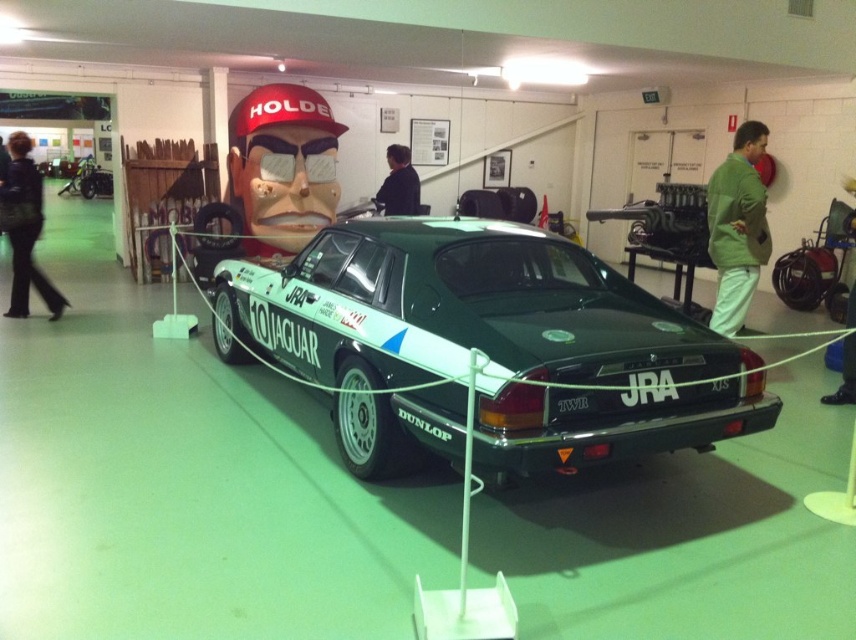
Question: Which of the following is the farthest from the observer?

Choices:
 (A) green fabric pants at lower right
 (B) black leather jacket at left

Answer: (B)

Question: Where is green matte car at center located in relation to black leather jacket at center in the image?

Choices:
 (A) left
 (B) right

Answer: (B)

Question: Which object is positioned farthest from the black leather jacket at left?

Choices:
 (A) green fabric pants at lower right
 (B) green matte car at center
 (C) green cotton jacket at right

Answer: (A)

Question: Can you confirm if black leather jacket at center is positioned below green fabric pants at lower right?

Choices:
 (A) no
 (B) yes

Answer: (A)

Question: Is black leather jacket at left to the left of green fabric pants at lower right from the viewer's perspective?

Choices:
 (A) no
 (B) yes

Answer: (B)

Question: Considering the real-world distances, which object is closest to the green fabric pants at lower right?

Choices:
 (A) green cotton jacket at right
 (B) black leather jacket at center
 (C) black leather jacket at left

Answer: (A)